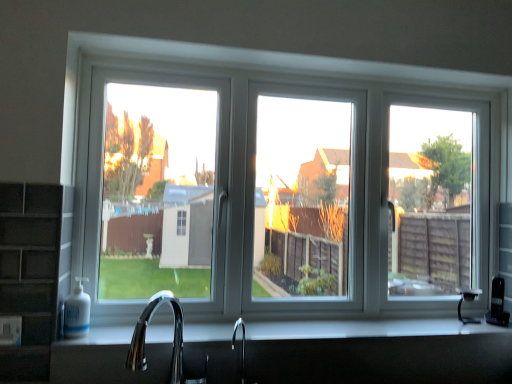
Question: Considering the positions of point (x=403, y=332) and point (x=152, y=309), is point (x=403, y=332) closer or farther from the camera than point (x=152, y=309)?

Choices:
 (A) farther
 (B) closer

Answer: (A)

Question: Considering their positions, is white glossy countertop at center located in front of or behind chrome metallic faucet at lower center?

Choices:
 (A) front
 (B) behind

Answer: (B)

Question: Which object is the closest to the chrome metallic faucet at lower center?

Choices:
 (A) white glossy countertop at center
 (B) white plastic window at center

Answer: (A)

Question: Considering the real-world distances, which object is farthest from the white plastic window at center?

Choices:
 (A) chrome metallic faucet at lower center
 (B) white glossy countertop at center

Answer: (A)